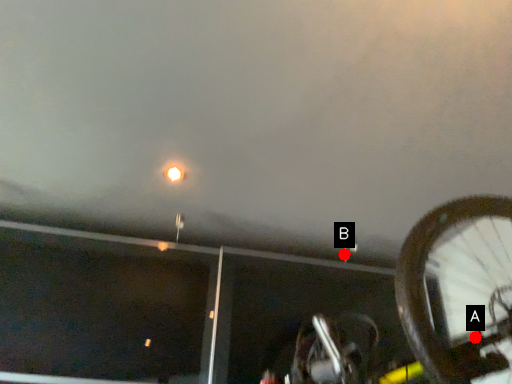
Question: Two points are circled on the image, labeled by A and B beside each circle. Among these points, which one is farthest from the camera?

Choices:
 (A) A is further
 (B) B is further

Answer: (B)